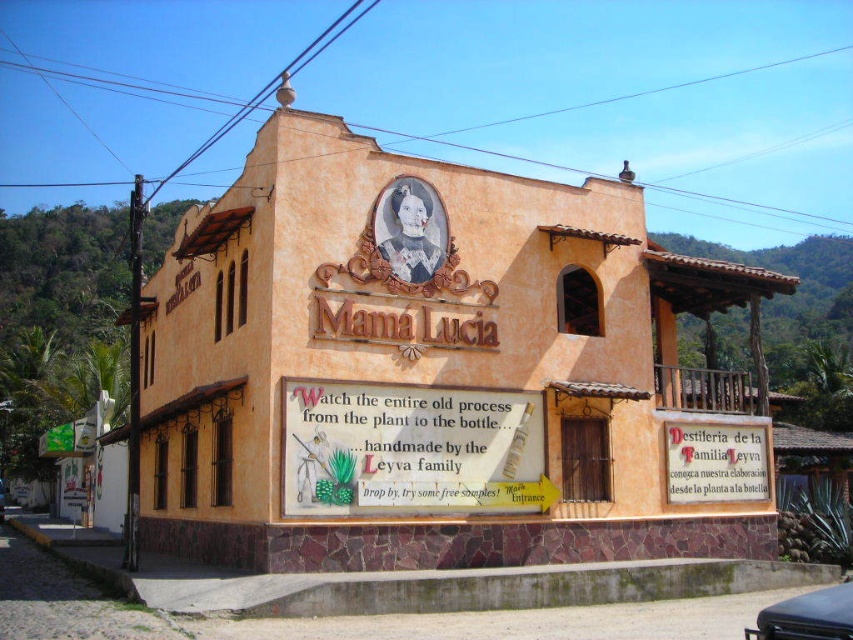
You are a delivery person trying to park your metallic silver car at center in front of the building. The wooden signboard at center is in the way. Can you park there without hitting the signboard?

The wooden signboard at center is narrower than the metallic silver car at center, so you can park there without hitting the signboard as long as you position the car carefully around it.

Looking at this image, you are a visitor approaching the building and want to read the white paper sign at center. Is the black matte car at lower right blocking your view of the sign?

The white paper sign at center occupies less space than black matte car at lower right, so the car is larger and might be blocking the view of the sign.